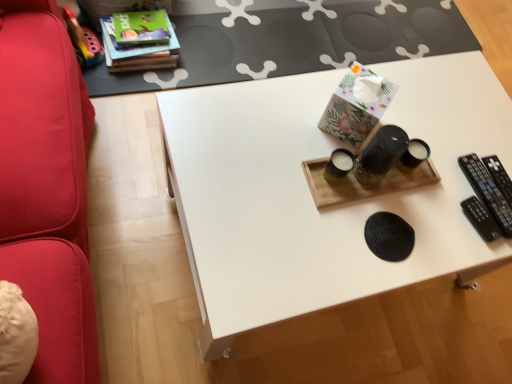
Identify the location of free space to the back side of black plastic remote at right. The width and height of the screenshot is (512, 384). (474, 132).